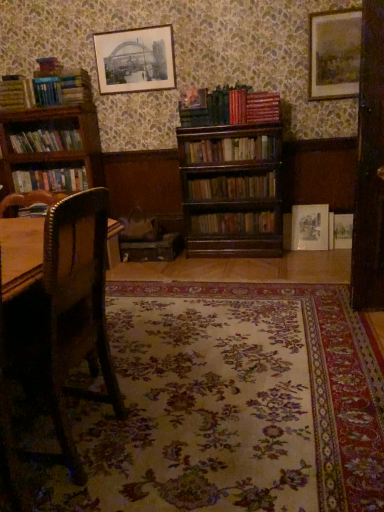
Measure the distance between point (26, 108) and camera.

Point (26, 108) is 12.53 feet away from camera.

Measure the distance between floral carpet at center and camera.

floral carpet at center and camera are 1.23 meters apart.

Measure the distance between point (x=302, y=216) and camera.

Point (x=302, y=216) and camera are 3.81 meters apart from each other.

Locate an element on the screen. The height and width of the screenshot is (512, 384). matte paper picture frame at upper right, the first picture frame from the bottom is located at coordinates (310, 227).

I want to click on brown wooden bookcase at left, so click(51, 139).

The height and width of the screenshot is (512, 384). What do you see at coordinates (262, 106) in the screenshot?
I see `striped fabric book at center, which is the 2th book in top-to-bottom order` at bounding box center [262, 106].

What do you see at coordinates (230, 150) in the screenshot? This screenshot has width=384, height=512. I see `wooden bookshelf at center, which ranks as the fourth book in bottom-to-top order` at bounding box center [230, 150].

Identify the location of wooden bookshelf at center, the fourth book positioned from the top. This screenshot has height=512, width=384. (230, 150).

Identify the location of hardcover book at left, which is the first book from top to bottom. Image resolution: width=384 pixels, height=512 pixels. (16, 93).

Can you confirm if floral carpet at center is shorter than wooden bookshelf at center, marked as the seventh book in a top-to-bottom arrangement?

Indeed, floral carpet at center has a lesser height compared to wooden bookshelf at center, marked as the seventh book in a top-to-bottom arrangement.

Is floral carpet at center not within wooden bookshelf at center, which is the 1th book in bottom-to-top order?

Indeed, floral carpet at center is completely outside wooden bookshelf at center, which is the 1th book in bottom-to-top order.

Is floral carpet at center facing away from wooden bookshelf at center, which is the 1th book in bottom-to-top order?

No, wooden bookshelf at center, which is the 1th book in bottom-to-top order, is not at the back of floral carpet at center.

Looking at this image, from the image's perspective, is floral carpet at center over wooden bookshelf at center, which is the 1th book in bottom-to-top order?

Incorrect, from the image's perspective, floral carpet at center is lower than wooden bookshelf at center, which is the 1th book in bottom-to-top order.

Consider the image. Is matte paper picture frame at upper right, the first picture frame from the bottom, touching hardcover books at left, arranged as the third book when ordered from the bottom?

matte paper picture frame at upper right, the first picture frame from the bottom, and hardcover books at left, arranged as the third book when ordered from the bottom, are not in contact.

From the image's perspective, would you say matte paper picture frame at upper right, the second picture frame viewed from the right, is positioned over hardcover books at left, the 5th book from the top?

No, from the image's perspective, matte paper picture frame at upper right, the second picture frame viewed from the right, is not above hardcover books at left, the 5th book from the top.

Is matte paper picture frame at upper right, the second picture frame viewed from the right, bigger or smaller than hardcover books at left, the 5th book from the top?

matte paper picture frame at upper right, the second picture frame viewed from the right, is smaller than hardcover books at left, the 5th book from the top.

Is matte paper picture frame at upper right, the first picture frame from the bottom, not within hardcover books at left, the 5th book from the top?

That's correct, matte paper picture frame at upper right, the first picture frame from the bottom, is outside of hardcover books at left, the 5th book from the top.

Which of these two, matte paper picture frame at upper right, the second picture frame viewed from the right, or hardcover book at left, which ranks as the 7th book in bottom-to-top order, stands taller?

Standing taller between the two is matte paper picture frame at upper right, the second picture frame viewed from the right.

Can you confirm if matte paper picture frame at upper right, the first picture frame from the bottom, is smaller than hardcover book at left, which is the first book from top to bottom?

Indeed, matte paper picture frame at upper right, the first picture frame from the bottom, has a smaller size compared to hardcover book at left, which is the first book from top to bottom.

Is wooden bookshelf at left, acting as the 3th book starting from the top, in front of or behind wooden picture frame at upper right, which is counted as the second picture frame, starting from the bottom, in the image?

wooden bookshelf at left, acting as the 3th book starting from the top, is behind wooden picture frame at upper right, which is counted as the second picture frame, starting from the bottom.

Is the surface of wooden bookshelf at left, which is the 5th book in bottom-to-top order, in direct contact with wooden picture frame at upper right, which is counted as the second picture frame, starting from the bottom?

wooden bookshelf at left, which is the 5th book in bottom-to-top order, and wooden picture frame at upper right, which is counted as the second picture frame, starting from the bottom, are not in contact.

Between wooden bookshelf at left, acting as the 3th book starting from the top, and wooden picture frame at upper right, which is counted as the second picture frame, starting from the bottom, which one has less height?

wooden bookshelf at left, acting as the 3th book starting from the top.

From the image's perspective, is wooden bookshelf at left, which is the 5th book in bottom-to-top order, positioned above or below wooden picture frame at upper right, which ranks as the 2th picture frame in top-to-bottom order?

From the image's perspective, wooden bookshelf at left, which is the 5th book in bottom-to-top order, appears below wooden picture frame at upper right, which ranks as the 2th picture frame in top-to-bottom order.

Is striped fabric book at center, which is the sixth book in bottom-to-top order, located outside wooden picture frame at upper right, which ranks as the 2th picture frame in top-to-bottom order?

Yes.

From a real-world perspective, is striped fabric book at center, which is the sixth book in bottom-to-top order, physically below wooden picture frame at upper right, which is counted as the second picture frame, starting from the bottom?

Yes.

Does hardcover book at left, which is the first book from top to bottom, come in front of brown wooden bookcase at left?

That is False.

From a real-world perspective, is hardcover book at left, which is the first book from top to bottom, located higher than brown wooden bookcase at left?

Correct, in the physical world, hardcover book at left, which is the first book from top to bottom, is higher than brown wooden bookcase at left.

This screenshot has width=384, height=512. Find the location of `bookcase lying in front of the hardcover book at left, which is the first book from top to bottom`. bookcase lying in front of the hardcover book at left, which is the first book from top to bottom is located at coordinates (51, 139).

Is hardcover book at left, which is the first book from top to bottom, touching brown wooden bookcase at left?

No, hardcover book at left, which is the first book from top to bottom, is not making contact with brown wooden bookcase at left.

From the image's perspective, between wooden bookshelf at center, the fourth book positioned from the top, and brown wooden bookcase at left, which one is located above?

brown wooden bookcase at left is shown above in the image.

Considering the sizes of objects wooden bookshelf at center, which ranks as the fourth book in bottom-to-top order, and brown wooden bookcase at left in the image provided, who is shorter, wooden bookshelf at center, which ranks as the fourth book in bottom-to-top order, or brown wooden bookcase at left?

wooden bookshelf at center, which ranks as the fourth book in bottom-to-top order.

Which book is the 3rd one when counting from the front of the brown wooden bookcase at left? Please provide its 2D coordinates.

[(230, 150)]

Identify the location of pattern below the wooden bookshelf at center, which is the 1th book in bottom-to-top order (from a real-world perspective). (230, 405).

Identify the location of the 3rd book located above the matte paper picture frame at upper right, the first picture frame from the bottom (from a real-world perspective). This screenshot has height=512, width=384. (50, 180).

Estimate the real-world distances between objects in this image. Which object is further from hardcover books at left, the 5th book from the top, brown wooden bookcase at left or hardcover book at left, which is the first book from top to bottom?

hardcover book at left, which is the first book from top to bottom, lies further to hardcover books at left, the 5th book from the top, than the other object.

Estimate the real-world distances between objects in this image. Which object is closer to hardcover books at left, the 5th book from the top, hardcover book at left, which ranks as the 7th book in bottom-to-top order, or matte paper picture frame at upper right, the first picture frame from the bottom?

Among the two, hardcover book at left, which ranks as the 7th book in bottom-to-top order, is located nearer to hardcover books at left, the 5th book from the top.

Based on their spatial positions, is striped fabric book at center, which is the 2th book in top-to-bottom order, or wooden bookshelf at center, which ranks as the fourth book in bottom-to-top order, further from brown wooden bookcase at left?

striped fabric book at center, which is the 2th book in top-to-bottom order, is further to brown wooden bookcase at left.

Estimate the real-world distances between objects in this image. Which object is further from hardcover books at left, the 5th book from the top, wooden picture frame at upper right, which is the first picture frame from right to left, or brown wooden bookcase at left?

Based on the image, wooden picture frame at upper right, which is the first picture frame from right to left, appears to be further to hardcover books at left, the 5th book from the top.

When comparing their distances from wooden bookshelf at center, the fourth book positioned from the top, does hardcover books at left, arranged as the third book when ordered from the bottom, or matte paper picture frame at upper center, arranged as the first picture frame when viewed from the left, seem closer?

matte paper picture frame at upper center, arranged as the first picture frame when viewed from the left, is positioned closer to the anchor wooden bookshelf at center, the fourth book positioned from the top.

Which object lies further to the anchor point hardcover book at left, which ranks as the 7th book in bottom-to-top order, matte paper picture frame at upper right, the second picture frame viewed from the right, or wooden bookshelf at center, the 2th book ordered from the bottom?

Among the two, matte paper picture frame at upper right, the second picture frame viewed from the right, is located further to hardcover book at left, which ranks as the 7th book in bottom-to-top order.

When comparing their distances from wooden picture frame at upper right, acting as the third picture frame starting from the left, does matte paper picture frame at upper right, the 3th picture frame from the top, or wooden bookshelf at center, which ranks as the fourth book in bottom-to-top order, seem further?

Among the two, matte paper picture frame at upper right, the 3th picture frame from the top, is located further to wooden picture frame at upper right, acting as the third picture frame starting from the left.

Based on their spatial positions, is hardcover books at left, the 5th book from the top, or brown wooden bookcase at left closer to wooden bookshelf at left, which is the 5th book in bottom-to-top order?

brown wooden bookcase at left.

At what (x,y) coordinates should I click in order to perform the action: click on rocking chair between floral carpet at center and matte paper picture frame at upper right, the first picture frame from the bottom, along the z-axis. Please return your answer as a coordinate pair (x, y). This screenshot has width=384, height=512. Looking at the image, I should click on (72, 313).

Identify the location of bookcase located between wooden bookshelf at left, which is the 5th book in bottom-to-top order, and striped fabric book at center, which is the sixth book in bottom-to-top order, in the left-right direction. (51, 139).

Locate an element on the screen. Image resolution: width=384 pixels, height=512 pixels. picture frame between wooden polished chair at left and wooden bookshelf at center, which ranks as the fourth book in bottom-to-top order, along the z-axis is located at coordinates (335, 54).

I want to click on bookcase situated between wooden bookshelf at left, acting as the 3th book starting from the top, and wooden bookshelf at center, which ranks as the fourth book in bottom-to-top order, from left to right, so click(x=51, y=139).